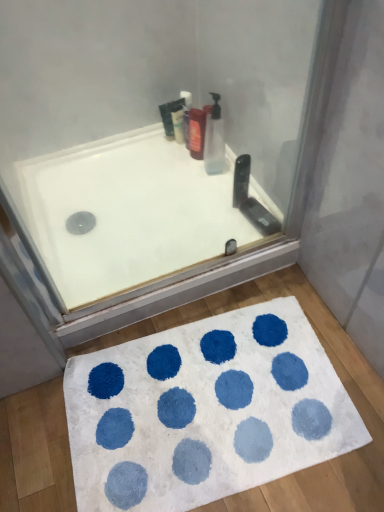
The image size is (384, 512). I want to click on free space in front of translucent plastic bottle at upper center, which appears as the 1th cleaning product when viewed from the left, so click(179, 156).